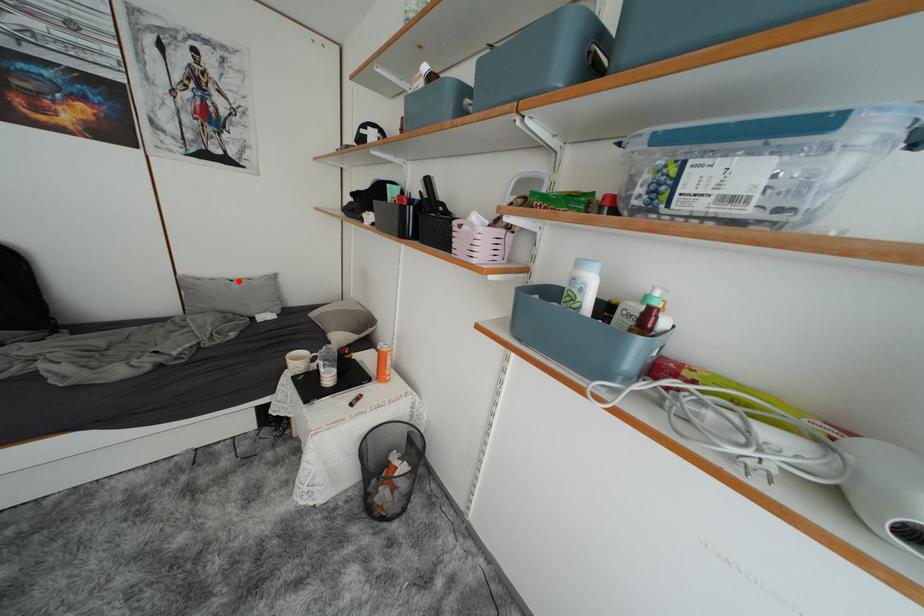
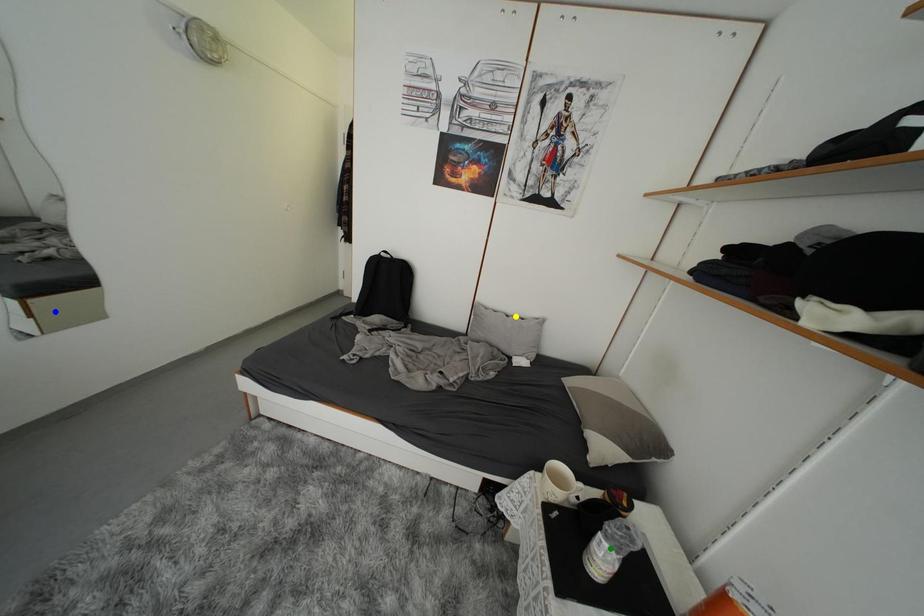
Question: I am providing you with two images of the same scene from different viewpoints. A red point is marked on the first image. You are given multiple points on the second image. Which spot in image 2 lines up with the point in image 1?

Choices:
 (A) green point
 (B) blue point
 (C) yellow point

Answer: (C)